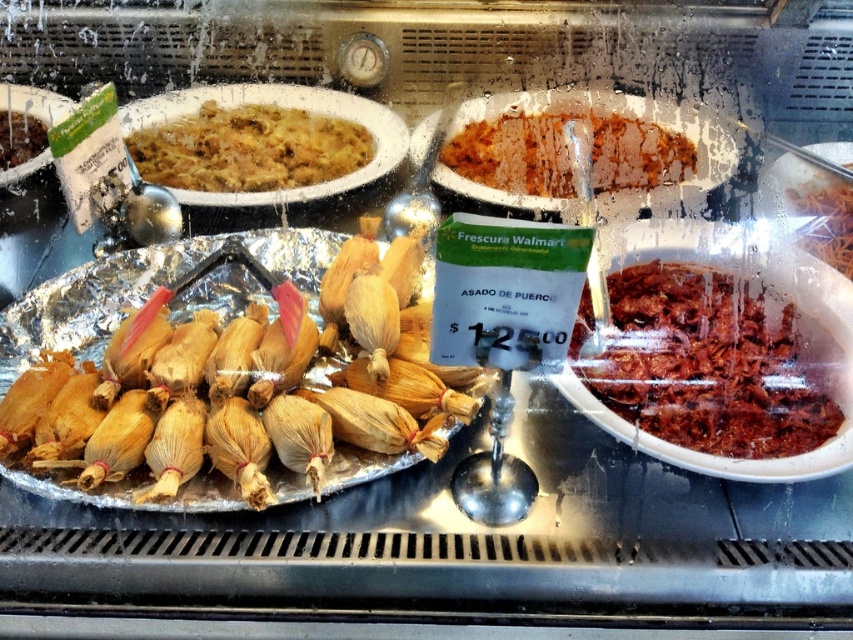
You are standing in front of the grocery store display case and want to reach both points. Which point, point (352, 157) or point (550, 161), is closer to you?

Point (352, 157) is closer to you because it is further to the viewer than point (550, 161).

You are a customer looking at the display case and want to choose between the yellowish matte rice at upper left and the brown crumbly rice at upper center. Based on their positions in the case, which one is placed higher?

The yellowish matte rice at upper left is placed higher than the brown crumbly rice at upper center.